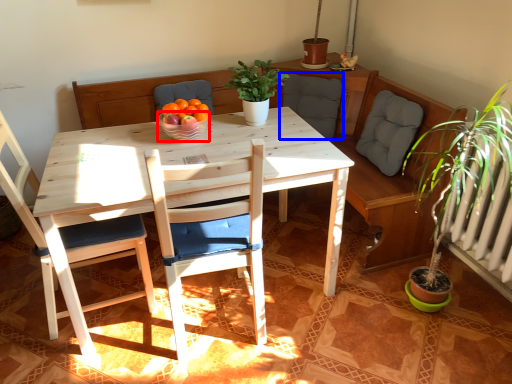
Question: Among these objects, which one is farthest to the camera, glass bowl (highlighted by a red box) or armchair (highlighted by a blue box)?

Choices:
 (A) glass bowl
 (B) armchair

Answer: (B)